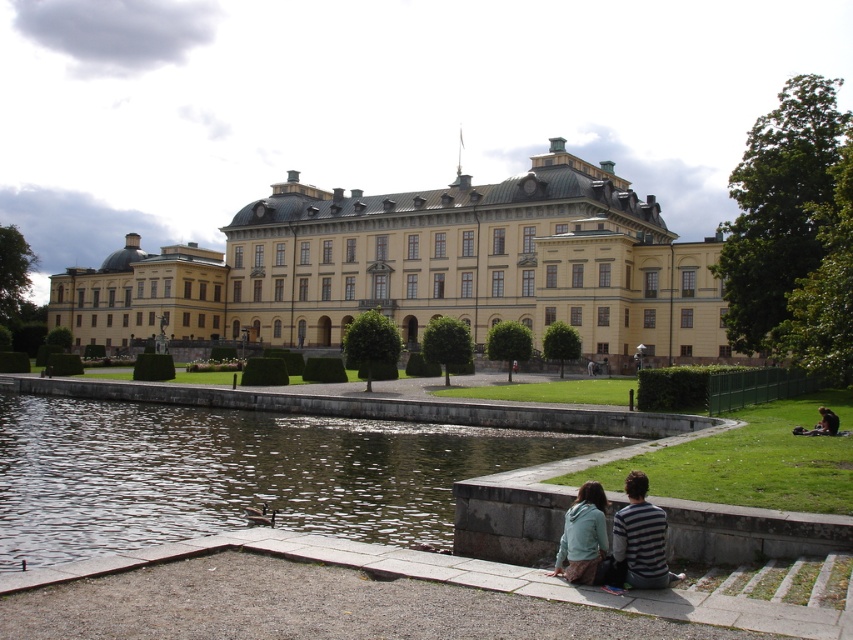
Based on the photo, is clear water at pond center to the left of blue denim jacket at lower center from the viewer's perspective?

Yes, clear water at pond center is to the left of blue denim jacket at lower center.

How distant is clear water at pond center from blue denim jacket at lower center?

74.50 feet

Between point (282, 442) and point (671, 584), which one is positioned in front?

Point (671, 584) is more forward.

The image size is (853, 640). Identify the location of clear water at pond center. (233, 474).

At what (x,y) coordinates should I click in order to perform the action: click on yellow stone building at center. Please return your answer as a coordinate pair (x, y). Image resolution: width=853 pixels, height=640 pixels. Looking at the image, I should click on (428, 268).

Between yellow stone building at center and light blue hoodie at lower center, which one has more height?

yellow stone building at center is taller.

Is point (473, 227) positioned after point (606, 552)?

Yes, point (473, 227) is farther from viewer.

Where is `yellow stone building at center`? The height and width of the screenshot is (640, 853). yellow stone building at center is located at coordinates (428, 268).

Is clear water at pond center shorter than light blue hoodie at lower center?

Indeed, clear water at pond center has a lesser height compared to light blue hoodie at lower center.

Is clear water at pond center wider than light blue hoodie at lower center?

Correct, the width of clear water at pond center exceeds that of light blue hoodie at lower center.

Where is `clear water at pond center`? clear water at pond center is located at coordinates (233, 474).